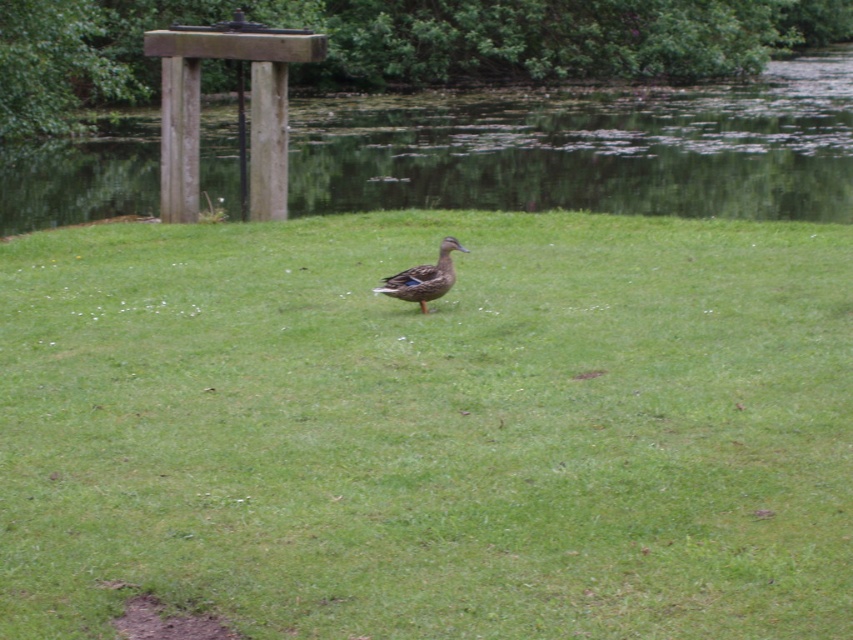
In the scene shown: You are a photographer trying to capture the shiny brown duck at center and the green grassy field at lower center in a single shot. Which object will appear closer to the camera in the photo?

The green grassy field at lower center will appear closer to the camera because the shiny brown duck at center is behind it.